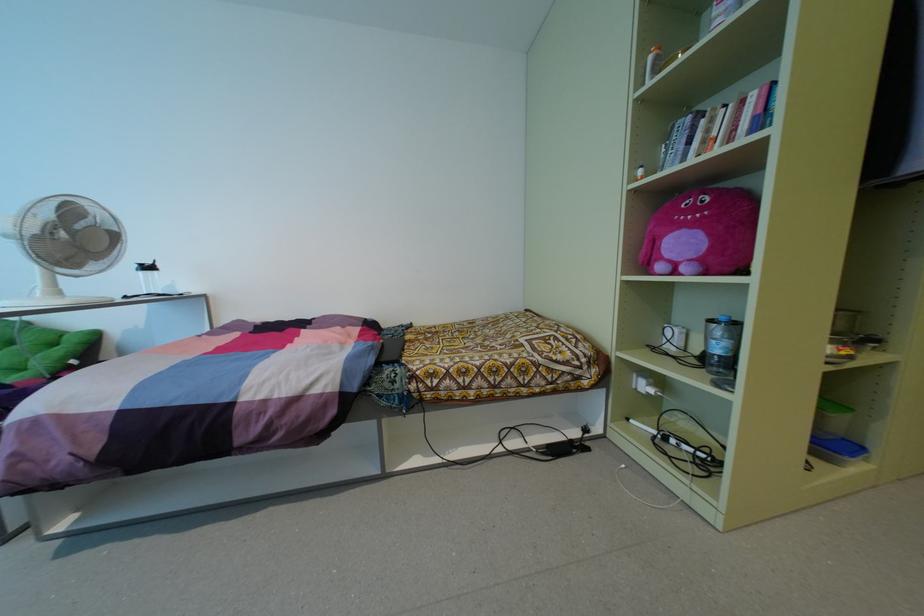
Identify the location of blue container lid. This screenshot has height=616, width=924. (835, 448).